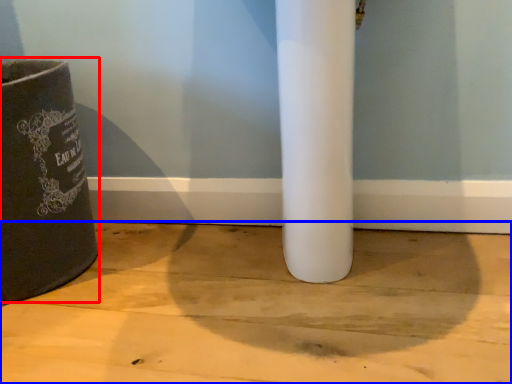
Question: Which of the following is the farthest to the observer, waste container (highlighted by a red box) or concrete (highlighted by a blue box)?

Choices:
 (A) waste container
 (B) concrete

Answer: (A)